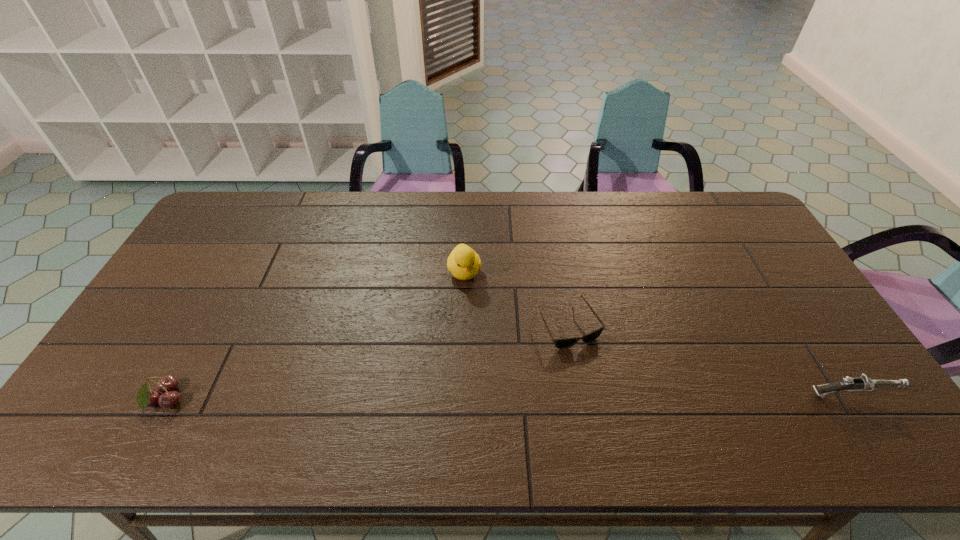
Where is `free space between the second farthest object and the farthest object`? free space between the second farthest object and the farthest object is located at coordinates (516, 298).

Where is `unoccupied position between the farthest object and the leftmost object`? Image resolution: width=960 pixels, height=540 pixels. unoccupied position between the farthest object and the leftmost object is located at coordinates (315, 336).

Locate an element on the screen. unoccupied position between the farthest object and the rightmost object is located at coordinates (657, 333).

Point out which object is positioned as the third nearest to the gun. Please provide its 2D coordinates. Your answer should be formatted as a tuple, i.e. [(x, y)], where the tuple contains the x and y coordinates of a point satisfying the conditions above.

[(146, 397)]

This screenshot has width=960, height=540. In order to click on object that can be found as the closest to the sunglasses in this screenshot , I will do `click(464, 263)`.

At what (x,y) coordinates should I click in order to perform the action: click on vacant region that satisfies the following two spatial constraints: 1. on the front side of the rightmost object; 2. aimed along the barrel of the farthest object. Please return your answer as a coordinate pair (x, y). The image size is (960, 540). Looking at the image, I should click on (461, 395).